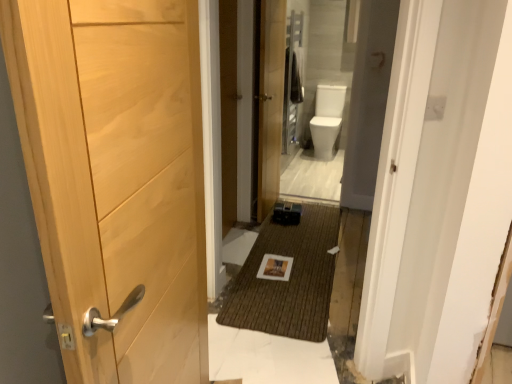
Image resolution: width=512 pixels, height=384 pixels. What are the coordinates of `wooden door at center, marked as the 2th door in a front-to-back arrangement` in the screenshot? It's located at (270, 103).

The height and width of the screenshot is (384, 512). What do you see at coordinates (270, 103) in the screenshot? I see `wooden door at center, marked as the 2th door in a front-to-back arrangement` at bounding box center [270, 103].

You are a GUI agent. You are given a task and a screenshot of the screen. Output one action in this format:
    pyautogui.click(x=<x>, y=<y>)
    Task: Click on the natural wood door at left, which appears as the 2th door when viewed from the back
    This screenshot has width=512, height=384.
    Given the screenshot: What is the action you would take?
    [116, 178]

Describe the element at coordinates (116, 178) in the screenshot. I see `natural wood door at left, positioned as the first door in front-to-back order` at that location.

Where is `wooden door at center, marked as the 2th door in a front-to-back arrangement`? The height and width of the screenshot is (384, 512). wooden door at center, marked as the 2th door in a front-to-back arrangement is located at coordinates (270, 103).

Which object is positioned more to the right, wooden door at center, marked as the 2th door in a front-to-back arrangement, or natural wood door at left, positioned as the 2th door in right-to-left order?

Positioned to the right is wooden door at center, marked as the 2th door in a front-to-back arrangement.

Which object is further away from the camera, wooden door at center, the first door from the right, or natural wood door at left, the 1th door from the left?

wooden door at center, the first door from the right.

Is point (275, 79) positioned in front of point (207, 334)?

No, (275, 79) is further to viewer.

From the image's perspective, is wooden door at center, the first door from the right, located above natural wood door at left, positioned as the 2th door in right-to-left order?

Yes, from the image's perspective, wooden door at center, the first door from the right, is over natural wood door at left, positioned as the 2th door in right-to-left order.

From a real-world perspective, does wooden door at center, placed as the second door when sorted from left to right, sit lower than natural wood door at left, positioned as the 2th door in right-to-left order?

Yes, from a real-world perspective, wooden door at center, placed as the second door when sorted from left to right, is beneath natural wood door at left, positioned as the 2th door in right-to-left order.

Considering the sizes of wooden door at center, the first door from the right, and natural wood door at left, positioned as the first door in front-to-back order, in the image, is wooden door at center, the first door from the right, wider or thinner than natural wood door at left, positioned as the first door in front-to-back order,?

wooden door at center, the first door from the right, is thinner than natural wood door at left, positioned as the first door in front-to-back order.

Considering the relative sizes of wooden door at center, the first door from the back, and natural wood door at left, positioned as the 2th door in right-to-left order, in the image provided, is wooden door at center, the first door from the back, taller than natural wood door at left, positioned as the 2th door in right-to-left order,?

Correct, wooden door at center, the first door from the back, is much taller as natural wood door at left, positioned as the 2th door in right-to-left order.

Is wooden door at center, the first door from the back, bigger or smaller than natural wood door at left, positioned as the 2th door in right-to-left order?

Considering their sizes, wooden door at center, the first door from the back, takes up less space than natural wood door at left, positioned as the 2th door in right-to-left order.

Is wooden door at center, the first door from the back, completely or partially outside of natural wood door at left, positioned as the first door in front-to-back order?

Yes, wooden door at center, the first door from the back, is outside of natural wood door at left, positioned as the first door in front-to-back order.

Is wooden door at center, the first door from the back, far away from natural wood door at left, which appears as the 2th door when viewed from the back?

Yes.

Is natural wood door at left, positioned as the 2th door in right-to-left order, at the back of wooden door at center, placed as the second door when sorted from left to right?

wooden door at center, placed as the second door when sorted from left to right, is not turned away from natural wood door at left, positioned as the 2th door in right-to-left order.

Based on the photo, measure the distance from wooden door at center, marked as the 2th door in a front-to-back arrangement, to natural wood door at left, which appears as the 2th door when viewed from the back.

wooden door at center, marked as the 2th door in a front-to-back arrangement, is 2.23 meters from natural wood door at left, which appears as the 2th door when viewed from the back.

Find the location of a particular element. This screenshot has width=512, height=384. door above the wooden door at center, placed as the second door when sorted from left to right (from a real-world perspective) is located at coordinates (116, 178).

Is natural wood door at left, the 1th door from the left, at the left side of wooden door at center, the first door from the back?

Correct, you'll find natural wood door at left, the 1th door from the left, to the left of wooden door at center, the first door from the back.

Considering their positions, is natural wood door at left, the 1th door from the left, located in front of or behind wooden door at center, the first door from the right?

natural wood door at left, the 1th door from the left, is in front of wooden door at center, the first door from the right.

Which is behind, point (26, 59) or point (281, 73)?

The point (281, 73) is farther.

From the image's perspective, which is above, natural wood door at left, positioned as the 2th door in right-to-left order, or wooden door at center, placed as the second door when sorted from left to right?

From the image's view, wooden door at center, placed as the second door when sorted from left to right, is above.

From a real-world perspective, is natural wood door at left, which appears as the 2th door when viewed from the back, located beneath wooden door at center, marked as the 2th door in a front-to-back arrangement?

Actually, natural wood door at left, which appears as the 2th door when viewed from the back, is physically above wooden door at center, marked as the 2th door in a front-to-back arrangement, in the real world.

Is natural wood door at left, positioned as the 2th door in right-to-left order, thinner than wooden door at center, placed as the second door when sorted from left to right?

In fact, natural wood door at left, positioned as the 2th door in right-to-left order, might be wider than wooden door at center, placed as the second door when sorted from left to right.

Between natural wood door at left, the 1th door from the left, and wooden door at center, the first door from the back, which one has more height?

wooden door at center, the first door from the back, is taller.

Which of these two, natural wood door at left, which appears as the 2th door when viewed from the back, or wooden door at center, the first door from the back, is bigger?

With larger size is natural wood door at left, which appears as the 2th door when viewed from the back.

Is natural wood door at left, the 1th door from the left, spatially inside wooden door at center, the first door from the back, or outside of it?

The correct answer is: outside.

Does natural wood door at left, positioned as the 2th door in right-to-left order, turn towards wooden door at center, the first door from the back?

No, natural wood door at left, positioned as the 2th door in right-to-left order, is not aimed at wooden door at center, the first door from the back.

How different are the orientations of natural wood door at left, which appears as the 2th door when viewed from the back, and wooden door at center, the first door from the right, in degrees?

There is a 7.56-degree angle between the facing directions of natural wood door at left, which appears as the 2th door when viewed from the back, and wooden door at center, the first door from the right.

How much distance is there between natural wood door at left, the 1th door from the left, and wooden door at center, the first door from the right?

natural wood door at left, the 1th door from the left, is 7.32 feet away from wooden door at center, the first door from the right.

This screenshot has height=384, width=512. I want to click on door directly beneath the natural wood door at left, which appears as the 2th door when viewed from the back (from a real-world perspective), so click(270, 103).

You are a GUI agent. You are given a task and a screenshot of the screen. Output one action in this format:
    pyautogui.click(x=<x>, y=<y>)
    Task: Click on the door that is behind the natural wood door at left, which appears as the 2th door when viewed from the back
    The image size is (512, 384).
    Given the screenshot: What is the action you would take?
    pyautogui.click(x=270, y=103)

Find the location of `door below the natural wood door at left, which appears as the 2th door when viewed from the back (from a real-world perspective)`. door below the natural wood door at left, which appears as the 2th door when viewed from the back (from a real-world perspective) is located at coordinates (270, 103).